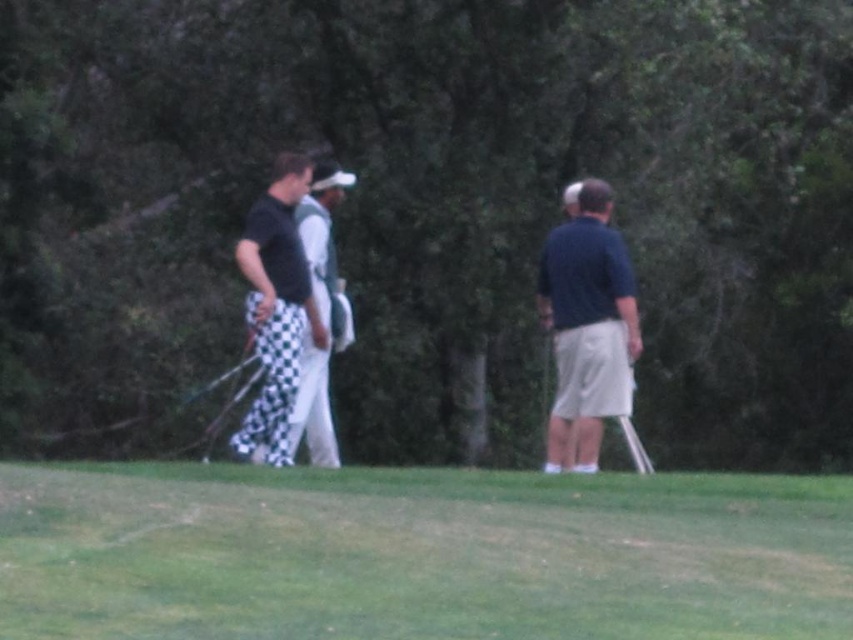
You are planning to set up a small tent for a quick break. The tent requires a flat area larger than the dark blue fabric shirt at center. Can the green grass at lower center accommodate the tent?

The green grass at lower center is larger in size than the dark blue fabric shirt at center, so yes, the tent can be set up there as it provides sufficient space.